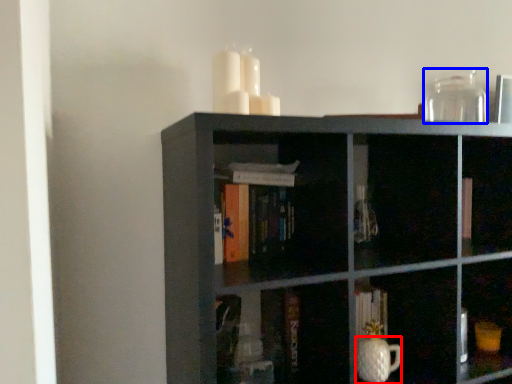
Question: Which of the following is the farthest to the observer, glass vase (highlighted by a red box) or glass vase (highlighted by a blue box)?

Choices:
 (A) glass vase
 (B) glass vase

Answer: (B)